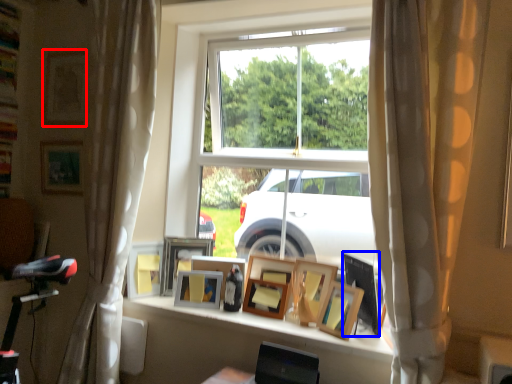
Question: Among these objects, which one is nearest to the camera, picture frame (highlighted by a red box) or picture frame (highlighted by a blue box)?

Choices:
 (A) picture frame
 (B) picture frame

Answer: (B)